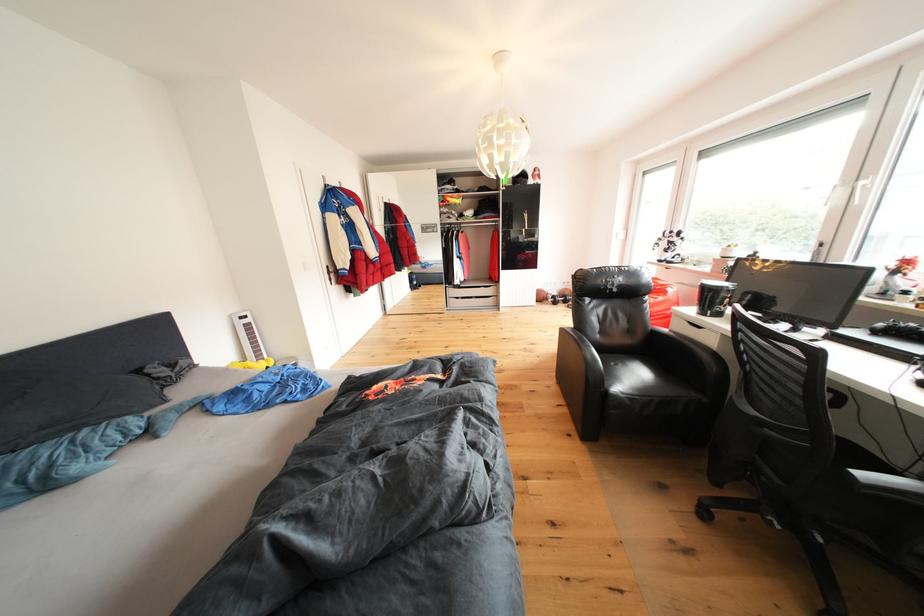
Describe the element at coordinates (890, 485) in the screenshot. This screenshot has width=924, height=616. I see `the black office chair armrest` at that location.